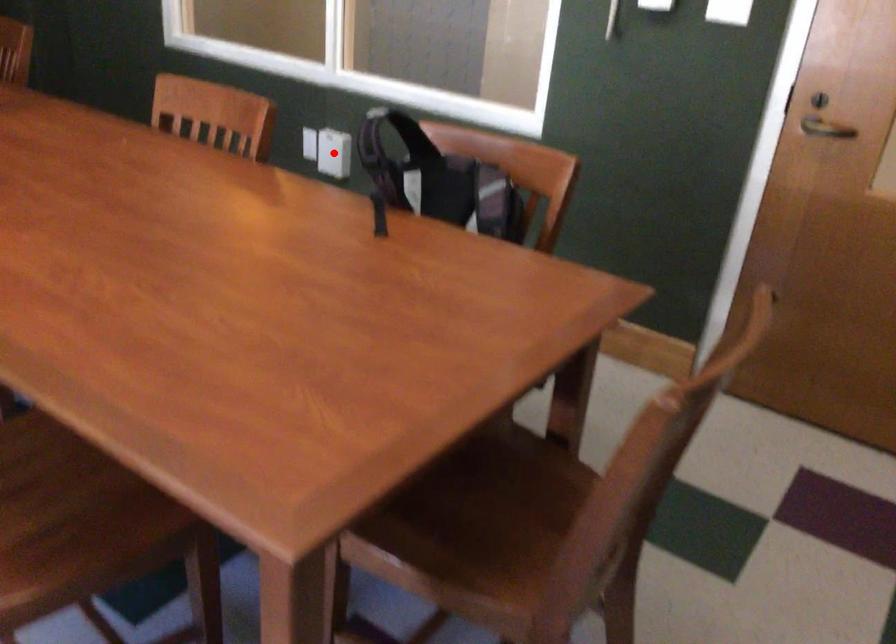
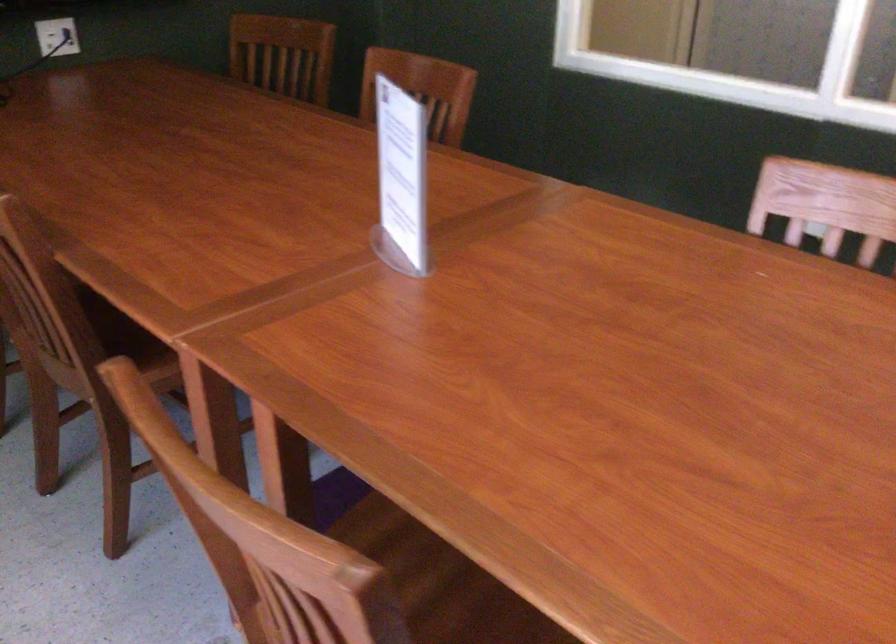
Question: I am providing you with two images of the same scene from different viewpoints. A red point is marked on the first image. Is the red point's position out of view in image 2?

Choices:
 (A) Yes
 (B) No

Answer: (A)